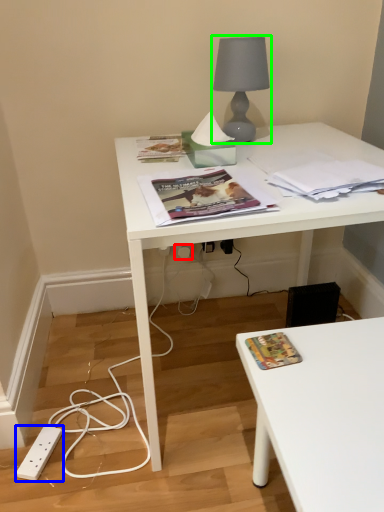
Question: Considering the real-world distances, which object is farthest from electric outlet (highlighted by a red box)? power plugs and sockets (highlighted by a blue box) or lamp (highlighted by a green box)?

Choices:
 (A) power plugs and sockets
 (B) lamp

Answer: (A)